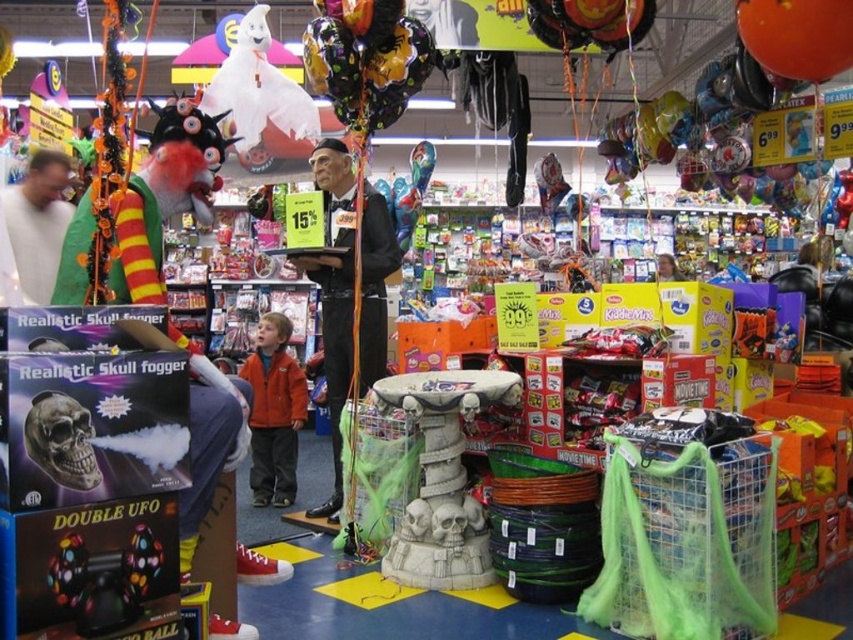
You are a delivery person who needs to place a new package on the shelf where the black glossy statue at center is located. The package is 3 meters long. Can you fit it horizontally on the shelf without moving the statue?

The black glossy statue at center is 3.37 meters from the camera, so the shelf must be at least 3.37 meters long to accommodate the statue. Since the package is only 3 meters long, it can fit horizontally on the shelf without moving the statue.